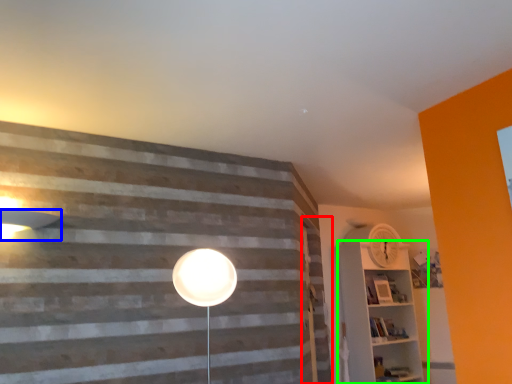
Question: Which object is the farthest from barn door (highlighted by a red box)? Choose among these: lamp (highlighted by a blue box) or shelf (highlighted by a green box).

Choices:
 (A) lamp
 (B) shelf

Answer: (A)